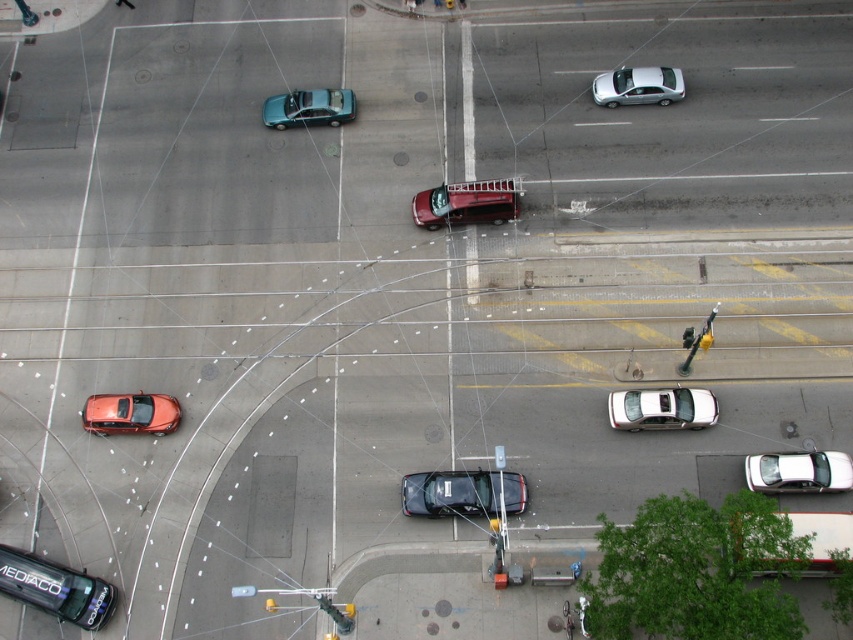
Does white matte truck at lower right have a greater height compared to metallic green car at upper center?

Correct, white matte truck at lower right is much taller as metallic green car at upper center.

Is white matte truck at lower right above metallic green car at upper center?

Incorrect, white matte truck at lower right is not positioned above metallic green car at upper center.

Is point (791, 570) farther from camera compared to point (315, 109)?

No.

Find the location of a particular element. Image resolution: width=853 pixels, height=640 pixels. white matte truck at lower right is located at coordinates (814, 544).

Who is higher up, shiny black sedan at center or metallic yellow traffic light at right?

metallic yellow traffic light at right is higher up.

Who is positioned more to the left, shiny black sedan at center or metallic yellow traffic light at right?

shiny black sedan at center

I want to click on shiny black sedan at center, so click(450, 493).

Between metallic green car at upper center and metallic yellow traffic light at right, which one is positioned higher?

metallic green car at upper center is above.

Is metallic green car at upper center thinner than metallic yellow traffic light at right?

Incorrect, metallic green car at upper center's width is not less than metallic yellow traffic light at right's.

This screenshot has width=853, height=640. Describe the element at coordinates (308, 108) in the screenshot. I see `metallic green car at upper center` at that location.

You are a GUI agent. You are given a task and a screenshot of the screen. Output one action in this format:
    pyautogui.click(x=<x>, y=<y>)
    Task: Click on the metallic green car at upper center
    This screenshot has height=640, width=853.
    Given the screenshot: What is the action you would take?
    [308, 108]